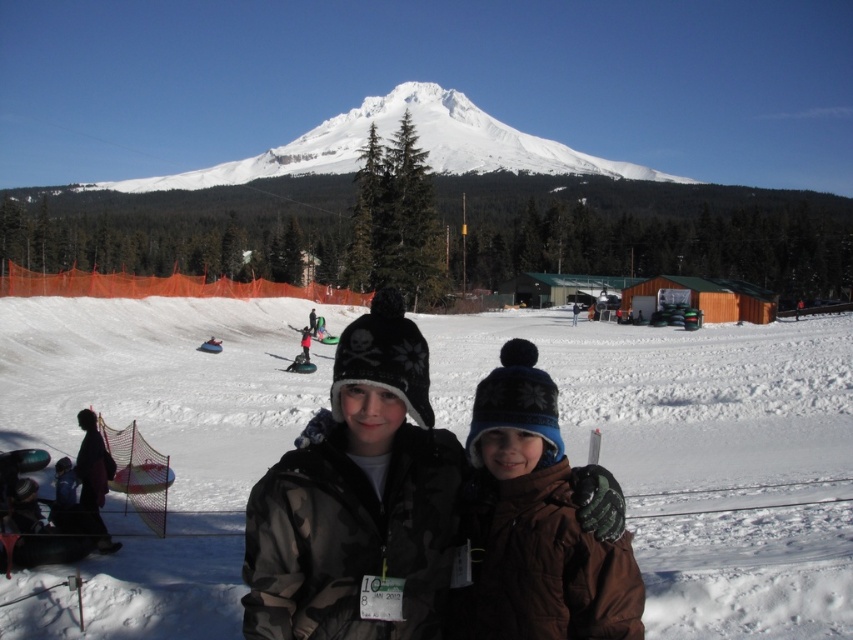
Does camouflage jacket at center appear on the right side of white snow-covered mountain at upper center?

Indeed, camouflage jacket at center is positioned on the right side of white snow-covered mountain at upper center.

Can you confirm if camouflage jacket at center is smaller than white snow-covered mountain at upper center?

Yes, camouflage jacket at center is smaller than white snow-covered mountain at upper center.

Find the location of a particular element. camouflage jacket at center is located at coordinates (358, 500).

Is white snow-covered mountain at upper center thinner than green plastic ski at center?

No, white snow-covered mountain at upper center is not thinner than green plastic ski at center.

What do you see at coordinates (418, 145) in the screenshot?
I see `white snow-covered mountain at upper center` at bounding box center [418, 145].

Where is `white snow-covered mountain at upper center`? white snow-covered mountain at upper center is located at coordinates (418, 145).

In the scene shown: Is camouflage jacket at center above brown fuzzy jacket at center?

Correct, camouflage jacket at center is located above brown fuzzy jacket at center.

Does camouflage jacket at center have a larger size compared to brown fuzzy jacket at center?

Indeed, camouflage jacket at center has a larger size compared to brown fuzzy jacket at center.

Between point (300, 572) and point (505, 420), which one is positioned behind?

The point (505, 420) is more distant.

What are the coordinates of `camouflage jacket at center` in the screenshot? It's located at (358, 500).